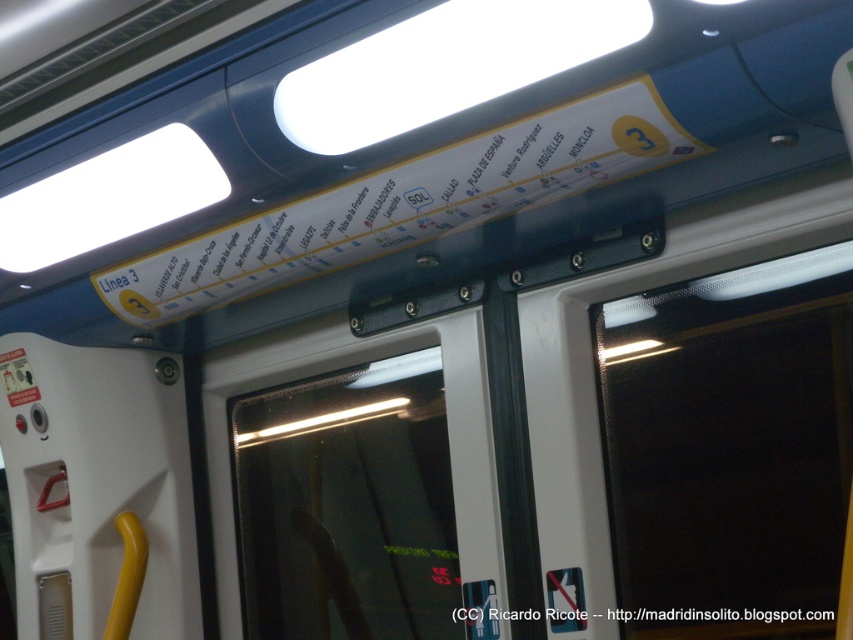
You are inside the metro train and see the point marked at coordinate (352,476). Which object is this point located on?

The point at coordinate (352,476) is located on the transparent glass door at center.

You are a passenger on the metro and want to know if you can fit a large backpack through the transparent glass door at center. The backpack is as wide as the white paper sign at upper center. Can it fit?

The transparent glass door at center might be wider than white paper sign at upper center. Since the backpack is as wide as the white paper sign at upper center, it might fit through the transparent glass door at center.